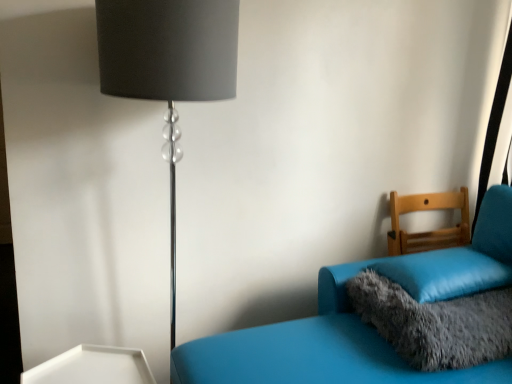
Question: Is light brown wooden chair at right, which ranks as the 1th furniture in back-to-front order, situated inside black metallic lamp at left or outside?

Choices:
 (A) outside
 (B) inside

Answer: (A)

Question: From the image's perspective, is light brown wooden chair at right, the second furniture from the front, above or below black metallic lamp at left?

Choices:
 (A) above
 (B) below

Answer: (B)

Question: Which object is the farthest from the light brown wooden chair at right, which ranks as the 1th furniture in back-to-front order?

Choices:
 (A) fluffy gray pillow at lower right, the 1th pillow when ordered from bottom to top
 (B) black metallic lamp at left
 (C) matte blue couch at right, which is the first furniture in front-to-back order
 (D) soft blue pillow at right, marked as the second pillow in a bottom-to-top arrangement

Answer: (B)

Question: Which of these objects is positioned farthest from the soft blue pillow at right, the first pillow viewed from the top?

Choices:
 (A) matte blue couch at right, which is the first furniture in front-to-back order
 (B) light brown wooden chair at right, which ranks as the 1th furniture in back-to-front order
 (C) black metallic lamp at left
 (D) fluffy gray pillow at lower right, which is the second pillow from top to bottom

Answer: (C)